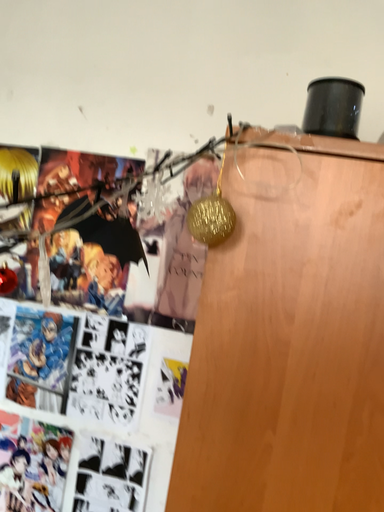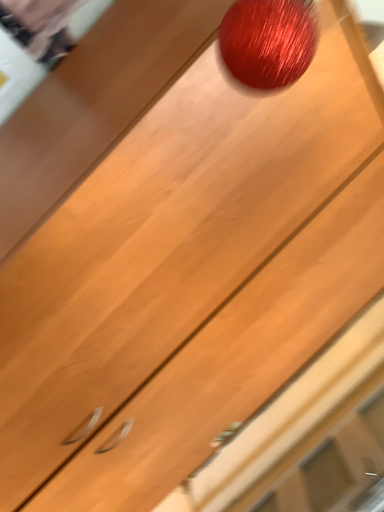
Question: Which way did the camera rotate in the video?

Choices:
 (A) rotated downward
 (B) rotated upward

Answer: (A)